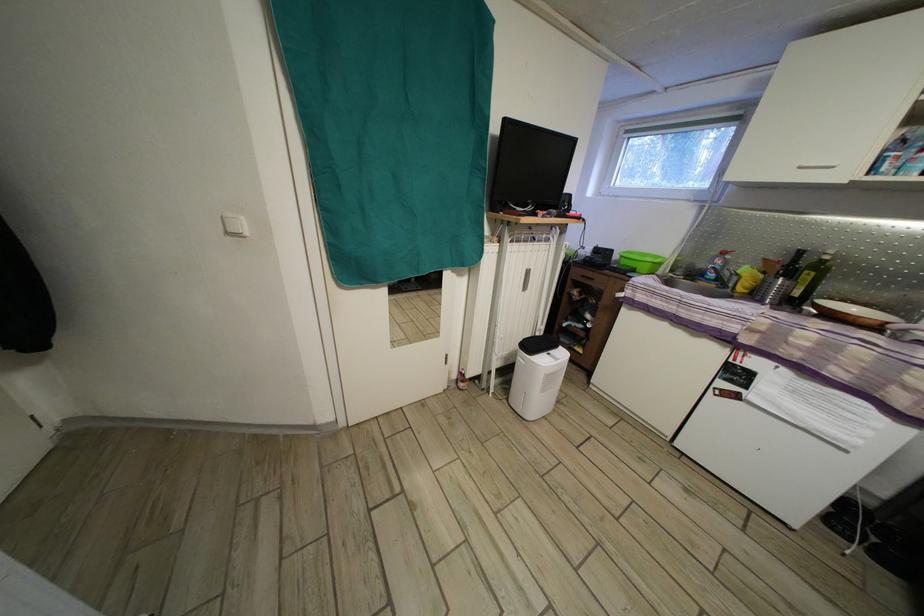
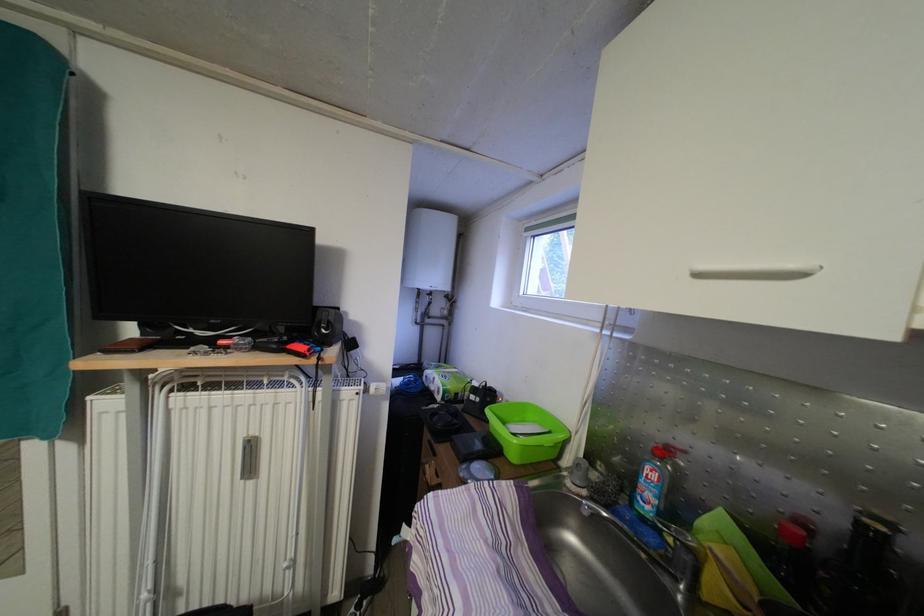
Where in the second image is the point corresponding to the point at 726,268 from the first image?

(661, 484)